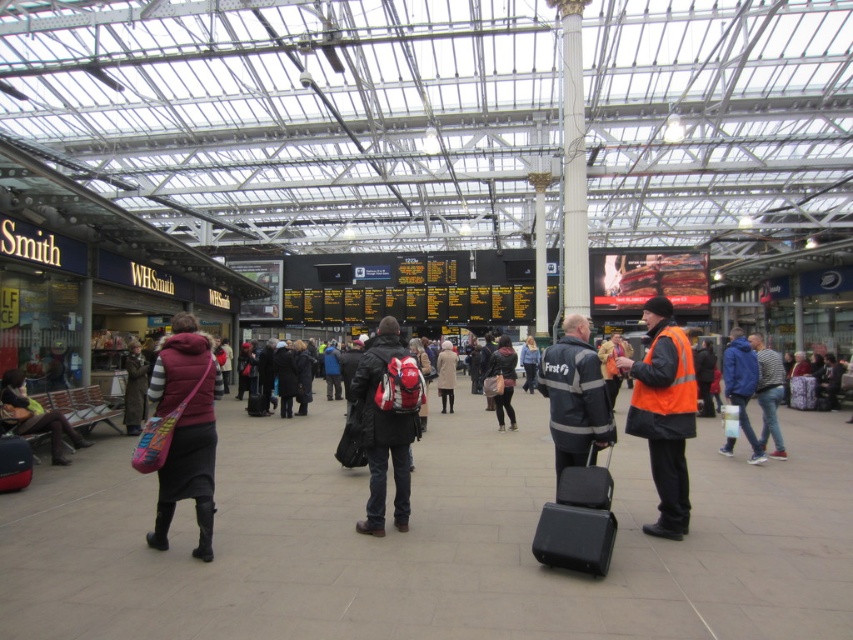
You are a passenger at the train station and you see a high visibility orange vest at center and a blue denim jacket at center. Which one is positioned to the right?

The high visibility orange vest at center is positioned to the right of the blue denim jacket at center.

You are a passenger at the train station and want to ask the staff member in the high visibility orange vest at center for directions. However, you notice another person wearing a blue denim jacket at center. Which individual is closer to you?

The high visibility orange vest at center is closer to you because it is in front of the blue denim jacket at center.

You are standing at the entrance of the train station and want to take a photo of both the point at coordinates point [199,506] and point [526,344]. Which point should you focus on first to ensure both are in clear view?

You should focus on point [199,506] first because it is closer to the camera than point [526,344], ensuring both points are in focus when using depth of field.